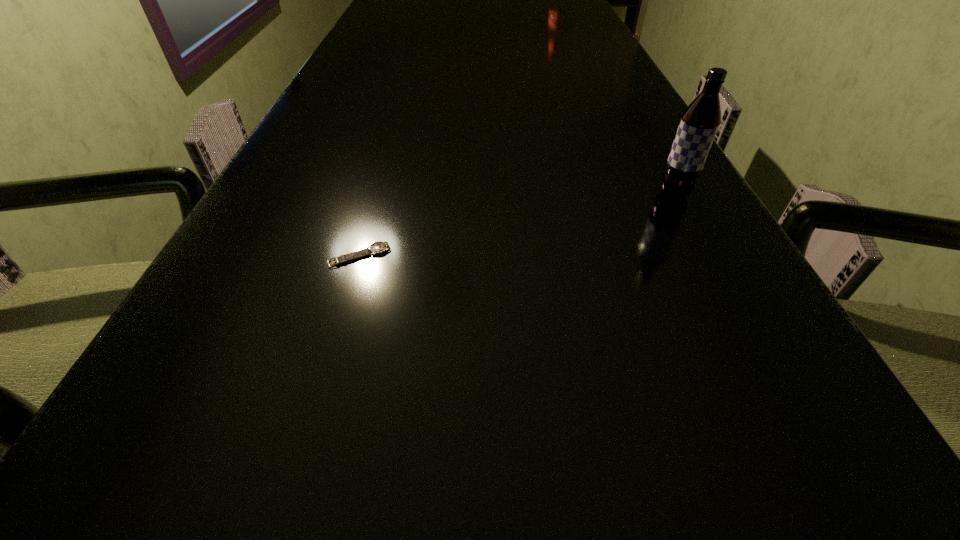
Locate an element on the screen. blank space at the far left corner of the desktop is located at coordinates (381, 0).

Where is `free space at the far right corner of the desktop`? The image size is (960, 540). free space at the far right corner of the desktop is located at coordinates click(x=560, y=4).

Locate an element on the screen. The height and width of the screenshot is (540, 960). free space between the nearer object and the farther object is located at coordinates (516, 225).

Image resolution: width=960 pixels, height=540 pixels. Find the location of `unoccupied area between the farther object and the shorter object`. unoccupied area between the farther object and the shorter object is located at coordinates (516, 225).

Locate an element on the screen. unoccupied position between the root beer and the watch is located at coordinates (516, 225).

Image resolution: width=960 pixels, height=540 pixels. Find the location of `free space that satisfies the following two spatial constraints: 1. on the back side of the watch; 2. on the left side of the farther object`. free space that satisfies the following two spatial constraints: 1. on the back side of the watch; 2. on the left side of the farther object is located at coordinates (377, 194).